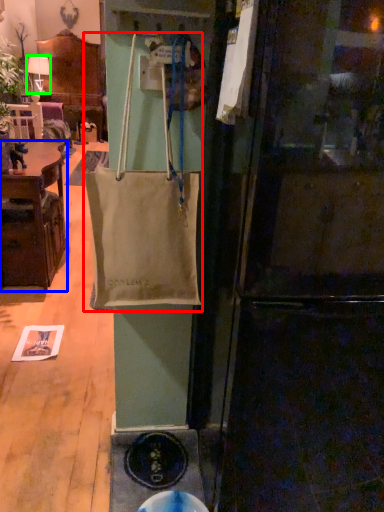
Question: Which object is the farthest from handbag (highlighted by a red box)? Choose among these: cabinetry (highlighted by a blue box) or lamp (highlighted by a green box).

Choices:
 (A) cabinetry
 (B) lamp

Answer: (B)